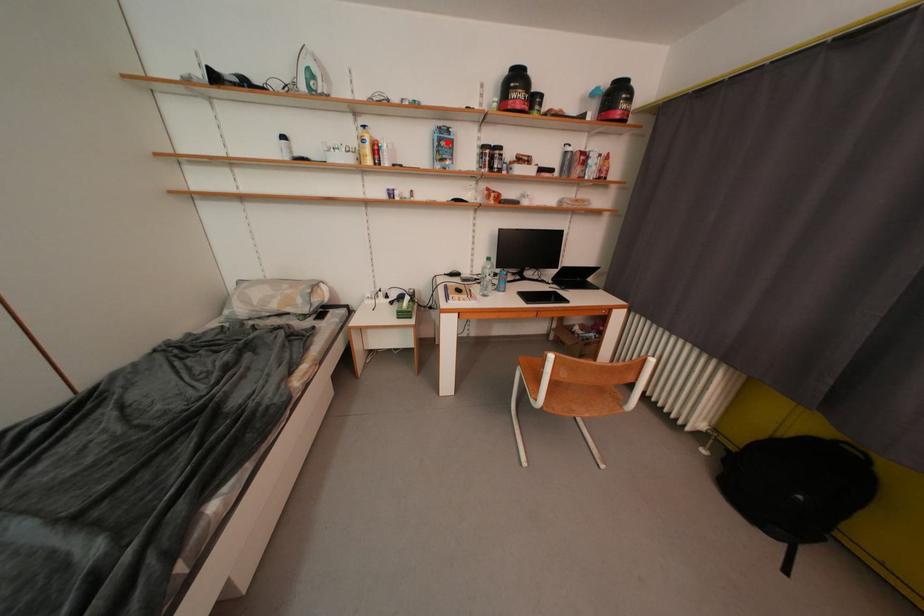
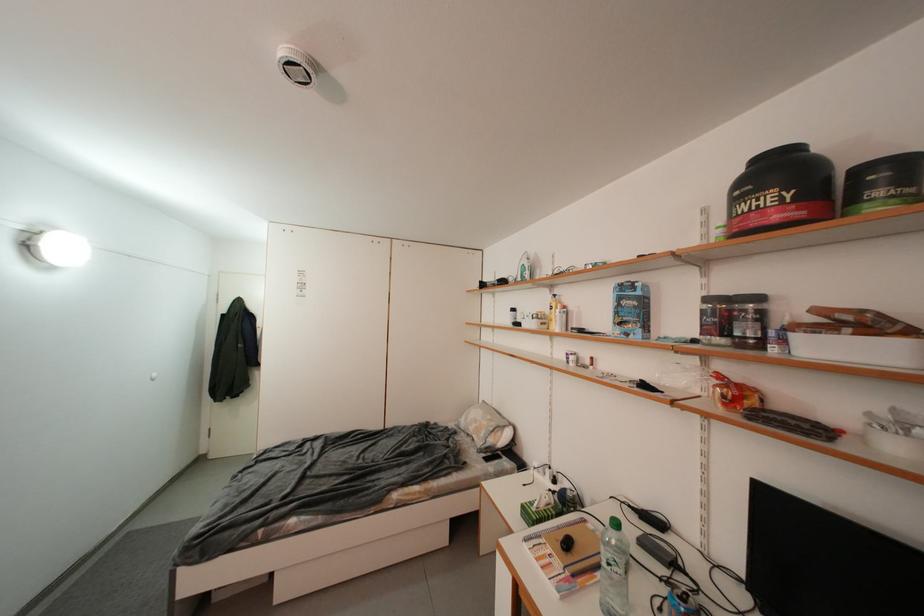
Locate, in the second image, the point that corresponds to the highlighted location in the first image.

(627, 302)